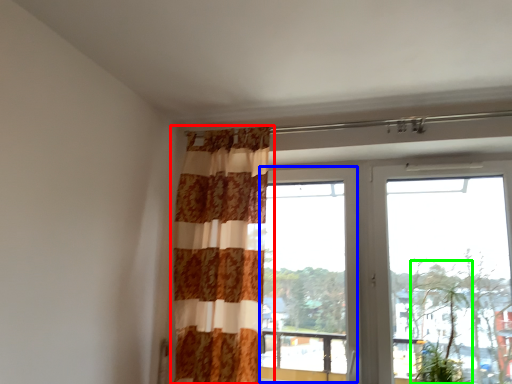
Question: Which object is positioned closest to curtain (highlighted by a red box)? Select from window (highlighted by a blue box) and plant (highlighted by a green box).

Choices:
 (A) window
 (B) plant

Answer: (A)